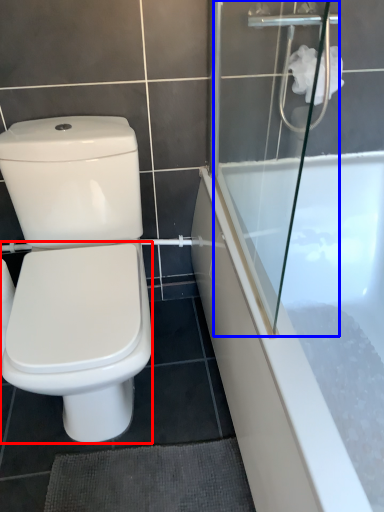
Question: Which object appears farthest to the camera in this image, bidet (highlighted by a red box) or shower door (highlighted by a blue box)?

Choices:
 (A) bidet
 (B) shower door

Answer: (A)